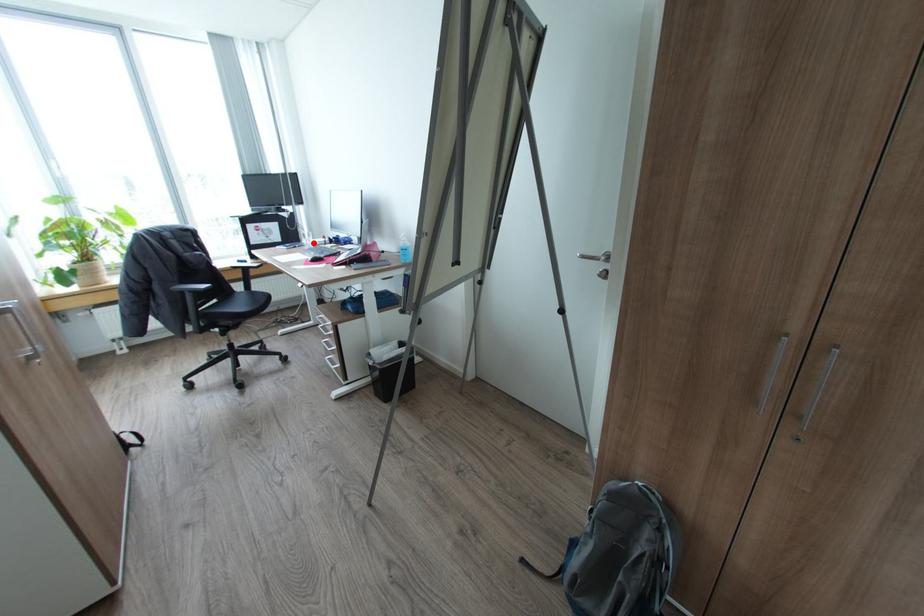
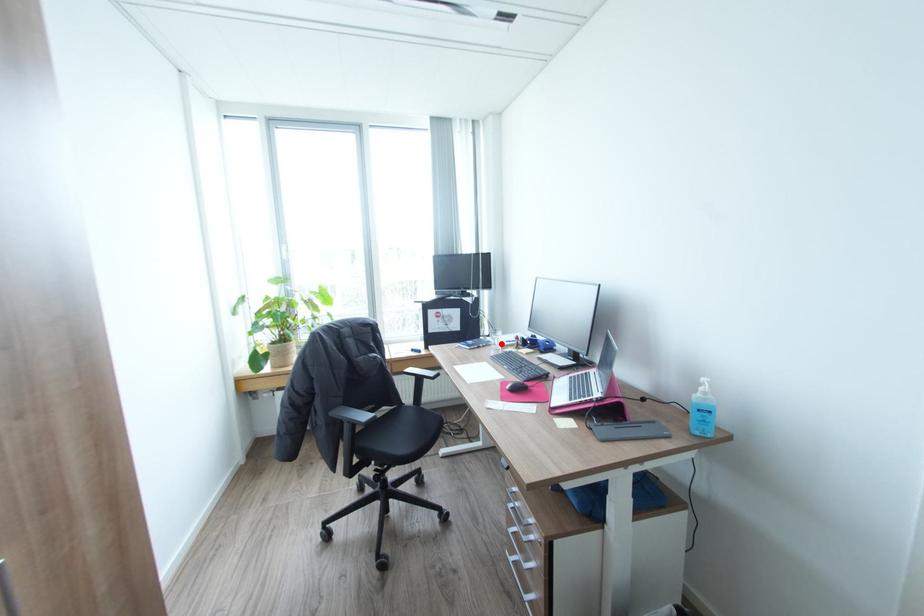
I am providing you with two images of the same scene from different viewpoints. A red point is marked on the first image and another point is marked on the second image. Is the marked point in image1 the same physical position as the marked point in image2?

Yes